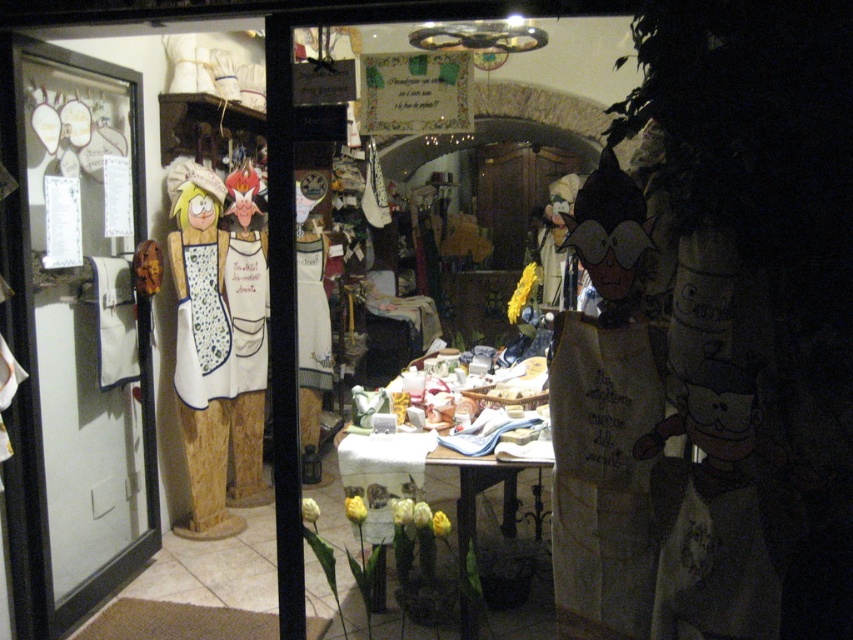
You are a customer entering the shop through the transparent glass door at left. After entering, you want to sit at the matte white tablecloth at center. Can you walk straight ahead from the door to reach the tablecloth?

The transparent glass door at left is positioned under the matte white tablecloth at center, meaning the tablecloth is directly above the door. Since the door is at the entrance, walking straight ahead would lead you under the tablecloth, but since it is positioned under, you might need to move sideways or adjust your path to reach it properly.

You are a customer entering the shop through the transparent glass door at left. After entering, you want to sit down at the matte white tablecloth at center. Is the door wide enough for you to pass through comfortably?

The transparent glass door at left has a smaller size compared to matte white tablecloth at center. Since the door is smaller, it might not be wide enough for comfortable passage, but without specific dimensions, we can infer that standard doors are typically passable. However, based on the description, the door is smaller, so there might be some tightness when passing through.

You are a delivery person with a box that is 12 feet long. You need to move the box from the transparent glass door at left to the matte white tablecloth at center. Can you move the box without tilting it sideways?

The transparent glass door at left and matte white tablecloth at center are 12.39 feet apart. Since the box is 12 feet long, it can be moved horizontally between them as the distance is sufficient.